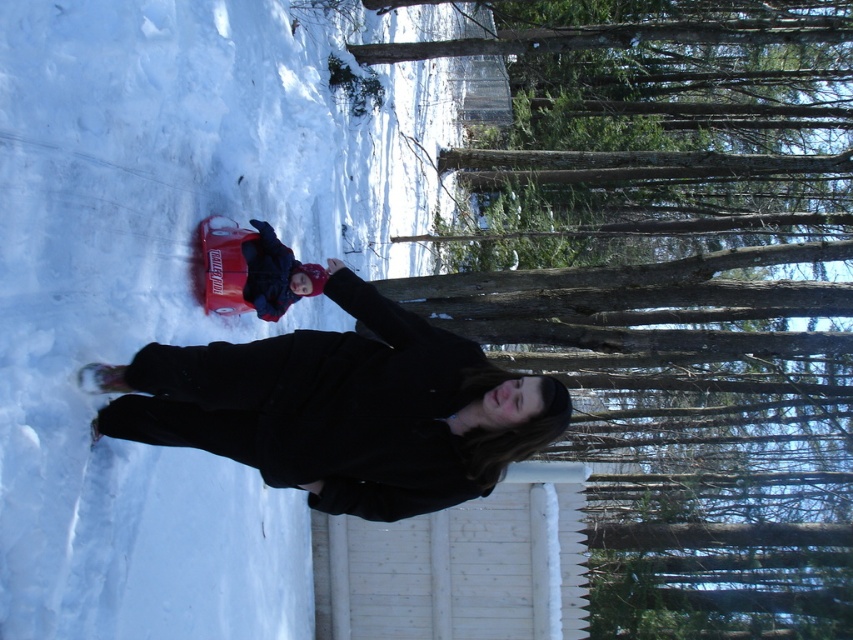
What is the 2D coordinate of the white fluffy snow at center?

The white fluffy snow at center is located at the 2D coordinate point of (178, 282).

You are a photographer trying to capture the perfect winter scene. You notice the white fluffy snow at center and the black woolen coat at center. Which object is positioned higher in the image?

The white fluffy snow at center is above the black woolen coat at center, so it is positioned higher in the image.